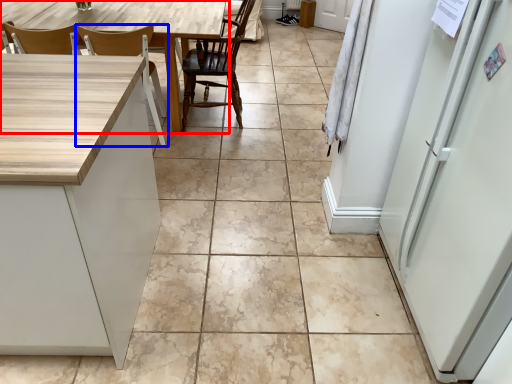
Question: Which object is closer to the camera taking this photo, table (highlighted by a red box) or chair (highlighted by a blue box)?

Choices:
 (A) table
 (B) chair

Answer: (B)